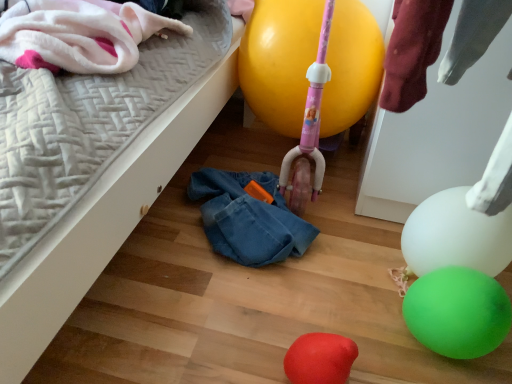
Locate an element on the screen. This screenshot has height=384, width=512. free location to the left of rubber balloon at lower center, which is the fourth balloon from top to bottom is located at coordinates (215, 355).